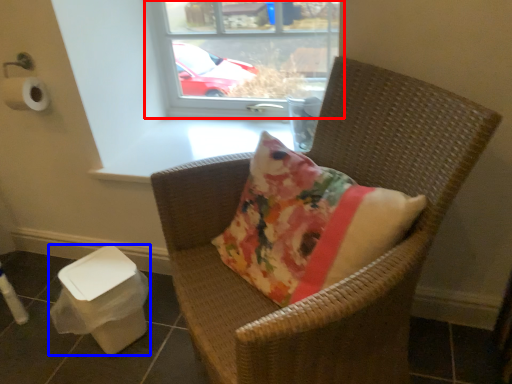
Question: Among these objects, which one is nearest to the camera, window (highlighted by a red box) or potty (highlighted by a blue box)?

Choices:
 (A) window
 (B) potty

Answer: (B)